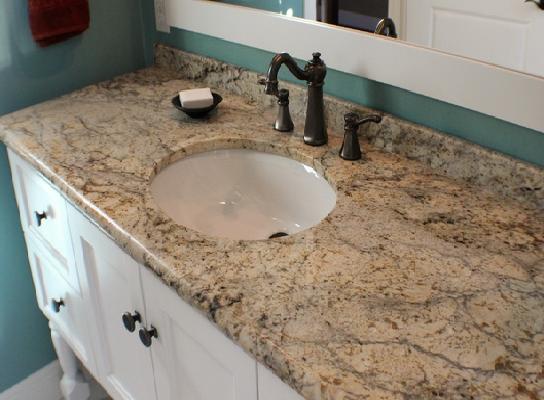
Where is `bowl`? The width and height of the screenshot is (544, 400). bowl is located at coordinates (208, 108).